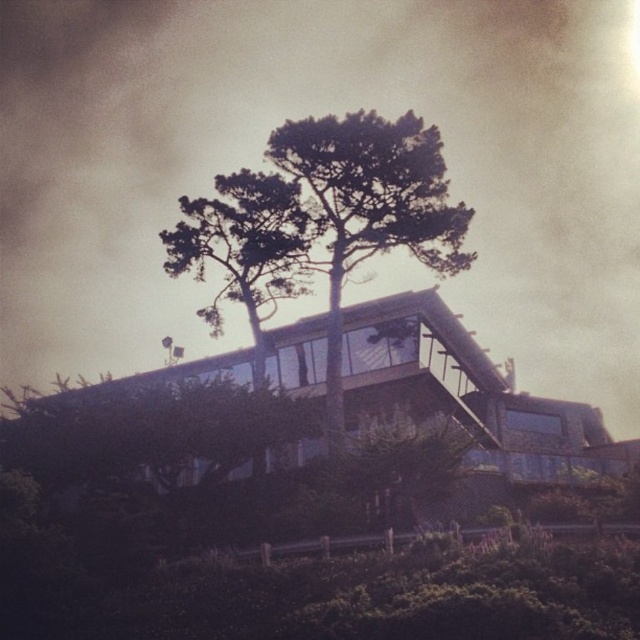
Question: Which point is closer to the camera?

Choices:
 (A) green leafy tree at center
 (B) dark gray cloud at upper center

Answer: (A)

Question: Estimate the real-world distances between objects in this image. Which object is farther from the dark gray cloud at upper center?

Choices:
 (A) dark green leafy tree at center
 (B) green leafy tree at center

Answer: (A)

Question: Is dark gray cloud at upper center positioned before dark green leafy tree at center?

Choices:
 (A) no
 (B) yes

Answer: (A)

Question: Can you confirm if green leafy tree at center is bigger than dark green leafy tree at center?

Choices:
 (A) yes
 (B) no

Answer: (A)

Question: From the image, what is the correct spatial relationship of dark gray cloud at upper center in relation to dark green leafy tree at center?

Choices:
 (A) left
 (B) right

Answer: (B)

Question: Which point is farther to the camera?

Choices:
 (A) (262, 216)
 (B) (432, 177)
 (C) (602, 196)

Answer: (C)